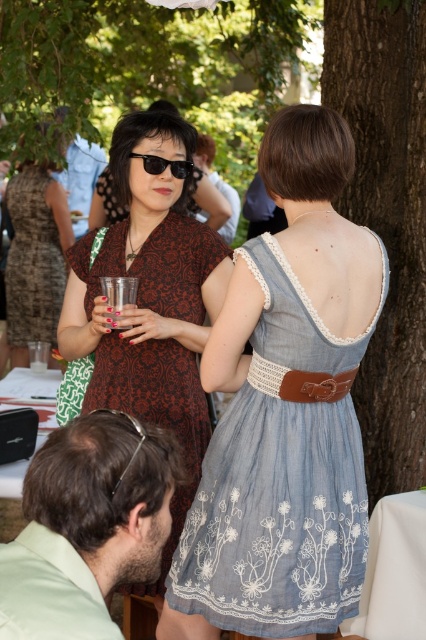
You are a photographer at the event and want to capture a photo that includes both the denim dress at center and the matte black dress at upper left. Based on their positions, which dress should be placed on the left side of the photo to maintain their actual spatial arrangement?

The matte black dress at upper left should be placed on the left side of the photo because the denim dress at center is positioned on the right side of it in the original image.

You are at the gathering and want to find the matte brown dress at center. Which direction should you look relative to the brown textured tree trunk at right?

You should look downward from the brown textured tree trunk at right to find the matte brown dress at center because the matte brown dress at center is located below the brown textured tree trunk at right.

In the scene shown: You are a photographer at the event and want to capture a photo of the clear plastic cup at center without the light green shirt at lower left blocking it. What should you do?

Move the camera to the side so that the light green shirt at lower left is no longer in front of the clear plastic cup at center.